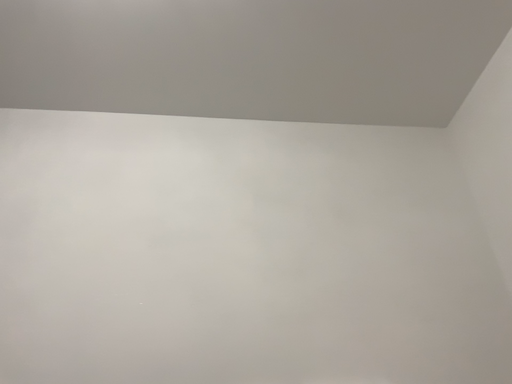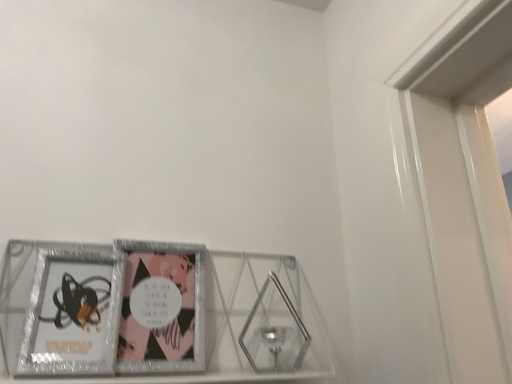
Question: How did the camera likely rotate when shooting the video?

Choices:
 (A) rotated upward
 (B) rotated downward

Answer: (B)